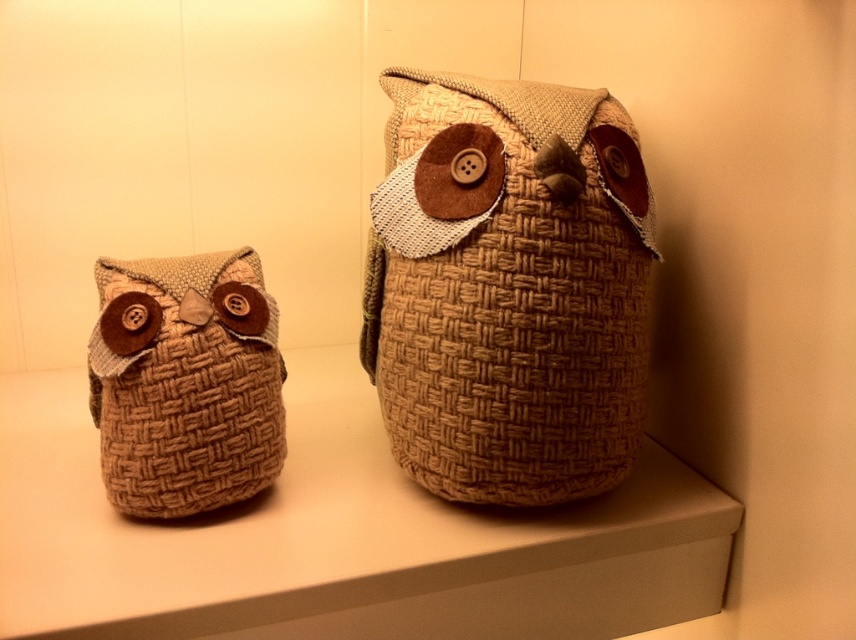
Question: Among these objects, which one is nearest to the camera?

Choices:
 (A) woven fabric owl at center
 (B) woven fabric shelf at center
 (C) woven fabric owl at left

Answer: (B)

Question: Estimate the real-world distances between objects in this image. Which object is farther from the woven fabric shelf at center?

Choices:
 (A) woven fabric owl at center
 (B) woven fabric owl at left

Answer: (A)

Question: Does woven fabric shelf at center lie in front of woven fabric owl at left?

Choices:
 (A) no
 (B) yes

Answer: (B)

Question: Among these points, which one is farthest from the camera?

Choices:
 (A) (480, 516)
 (B) (134, 481)
 (C) (421, 365)

Answer: (A)

Question: Is woven fabric shelf at center below woven fabric owl at left?

Choices:
 (A) no
 (B) yes

Answer: (B)

Question: Considering the relative positions of woven fabric owl at center and woven fabric owl at left in the image provided, where is woven fabric owl at center located with respect to woven fabric owl at left?

Choices:
 (A) right
 (B) left

Answer: (A)